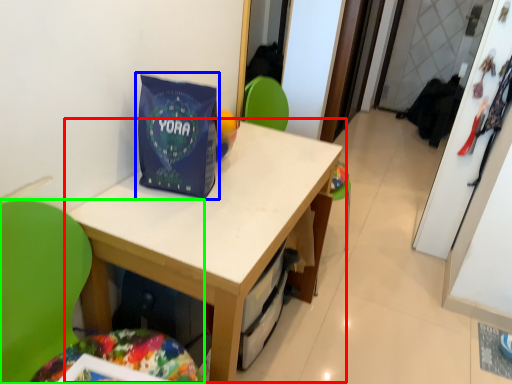
Question: Which object is the closest to the table (highlighted by a red box)? Choose among these: gift bag (highlighted by a blue box) or chair (highlighted by a green box).

Choices:
 (A) gift bag
 (B) chair

Answer: (A)